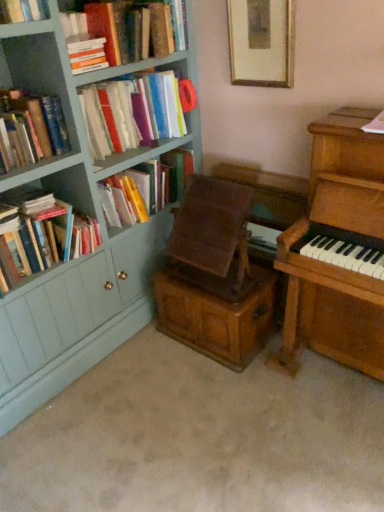
Looking at this image, what is the approximate height of hardcover books at upper left, the 6th book ordered from the bottom?

The height of hardcover books at upper left, the 6th book ordered from the bottom, is 10.44 inches.

At what (x,y) coordinates should I click in order to perform the action: click on wooden piano at right. Please return your answer as a coordinate pair (x, y). Looking at the image, I should click on (338, 250).

You are a GUI agent. You are given a task and a screenshot of the screen. Output one action in this format:
    pyautogui.click(x=<x>, y=<y>)
    Task: Click on the hardcover books at left, positioned as the fourth book in top-to-bottom order
    This screenshot has height=512, width=384.
    Given the screenshot: What is the action you would take?
    pyautogui.click(x=30, y=129)

Identify the location of hardcover books at upper left, the fourth book positioned from the bottom. (131, 113).

In order to click on hardcover books at left, which is counted as the first book, starting from the bottom in this screenshot , I will do `click(50, 228)`.

This screenshot has height=512, width=384. What do you see at coordinates (156, 181) in the screenshot? I see `hardcover book at left, the 5th book viewed from the top` at bounding box center [156, 181].

This screenshot has width=384, height=512. I want to click on hardcover books at upper left, which appears as the first book when viewed from the top, so click(x=126, y=27).

Does wooden chest at center turn towards wooden piano at right?

No, wooden chest at center is not oriented towards wooden piano at right.

Based on their positions, is wooden chest at center located to the left or right of wooden piano at right?

wooden chest at center is positioned on wooden piano at right's left side.

Considering the points (179, 305) and (349, 110), which point is behind, point (179, 305) or point (349, 110)?

The point (179, 305) is more distant.

Considering the positions of objects wooden chest at center and wooden piano at right in the image provided, who is in front, wooden chest at center or wooden piano at right?

wooden piano at right is closer to the camera.

Does hardcover books at upper left, the 6th book ordered from the bottom, have a greater height compared to hardcover book at left, the 2th book ordered from the bottom?

No, hardcover books at upper left, the 6th book ordered from the bottom, is not taller than hardcover book at left, the 2th book ordered from the bottom.

From a real-world perspective, is hardcover books at upper left, which appears as the first book when viewed from the top, over hardcover book at left, the 5th book viewed from the top?

Correct, in the physical world, hardcover books at upper left, which appears as the first book when viewed from the top, is higher than hardcover book at left, the 5th book viewed from the top.

How distant is hardcover books at upper left, the 6th book ordered from the bottom, from hardcover book at left, the 5th book viewed from the top?

The distance of hardcover books at upper left, the 6th book ordered from the bottom, from hardcover book at left, the 5th book viewed from the top, is 23.04 inches.

In the image, is hardcover books at upper left, the 6th book ordered from the bottom, positioned in front of or behind hardcover book at left, the 5th book viewed from the top?

hardcover books at upper left, the 6th book ordered from the bottom, is in front of hardcover book at left, the 5th book viewed from the top.

Do you think hardcover books at upper left, the fourth book positioned from the bottom, is within hardcover books at upper left, the 6th book ordered from the bottom, or outside of it?

hardcover books at upper left, the fourth book positioned from the bottom, is not enclosed by hardcover books at upper left, the 6th book ordered from the bottom.

From a real-world perspective, is hardcover books at upper left, the fourth book positioned from the bottom, located beneath hardcover books at upper left, the 6th book ordered from the bottom?

Yes, from a real-world perspective, hardcover books at upper left, the fourth book positioned from the bottom, is below hardcover books at upper left, the 6th book ordered from the bottom.

Is point (150, 181) positioned after point (262, 319)?

Yes, point (150, 181) is behind point (262, 319).

Is wooden chest at center inside hardcover book at left, the 5th book viewed from the top?

No, wooden chest at center is not inside hardcover book at left, the 5th book viewed from the top.

In terms of size, does hardcover book at left, the 5th book viewed from the top, appear bigger or smaller than wooden chest at center?

hardcover book at left, the 5th book viewed from the top, is smaller than wooden chest at center.

Is point (248, 16) closer to viewer compared to point (56, 210)?

No, it is not.

Is wooden picture frame at upper center at the right side of hardcover books at left, which is counted as the first book, starting from the bottom?

Correct, you'll find wooden picture frame at upper center to the right of hardcover books at left, which is counted as the first book, starting from the bottom.

Can you confirm if wooden picture frame at upper center is shorter than hardcover books at left, which is counted as the first book, starting from the bottom?

No.

Considering the relative sizes of wooden picture frame at upper center and hardcover books at left, which is counted as the first book, starting from the bottom, in the image provided, is wooden picture frame at upper center bigger than hardcover books at left, which is counted as the first book, starting from the bottom,?

No.

In the scene shown: Considering the relative positions of hardcover book at left, the 2th book ordered from the bottom, and wooden piano at right in the image provided, is hardcover book at left, the 2th book ordered from the bottom, to the right of wooden piano at right from the viewer's perspective?

Incorrect, hardcover book at left, the 2th book ordered from the bottom, is not on the right side of wooden piano at right.

Is hardcover book at left, the 5th book viewed from the top, next to wooden piano at right and touching it?

There is a gap between hardcover book at left, the 5th book viewed from the top, and wooden piano at right.

Identify the location of piano on the right of hardcover book at left, the 5th book viewed from the top. (338, 250).

From the image's perspective, which one is positioned lower, hardcover book at left, the 5th book viewed from the top, or wooden piano at right?

wooden piano at right appears lower in the image.

Does hardcover books at left, the 6th book in the top-to-bottom sequence, turn towards hardcover books at left, the 3th book in the bottom-to-top sequence?

No, hardcover books at left, the 6th book in the top-to-bottom sequence, is not facing towards hardcover books at left, the 3th book in the bottom-to-top sequence.

Is hardcover books at left, the 6th book in the top-to-bottom sequence, further to camera compared to hardcover books at left, positioned as the fourth book in top-to-bottom order?

Yes, hardcover books at left, the 6th book in the top-to-bottom sequence, is further from the camera.

Can you see hardcover books at left, the 6th book in the top-to-bottom sequence, touching hardcover books at left, positioned as the fourth book in top-to-bottom order?

No, hardcover books at left, the 6th book in the top-to-bottom sequence, is not next to hardcover books at left, positioned as the fourth book in top-to-bottom order.

Is hardcover books at left, which is counted as the first book, starting from the bottom, bigger or smaller than hardcover books at left, positioned as the fourth book in top-to-bottom order?

Clearly, hardcover books at left, which is counted as the first book, starting from the bottom, is larger in size than hardcover books at left, positioned as the fourth book in top-to-bottom order.

What are the coordinates of `piano above the wooden chest at center (from the image's perspective)` in the screenshot? It's located at [338, 250].

Which book is the 4th one when counting from the back of the hardcover books at upper left, the 6th book ordered from the bottom? Please provide its 2D coordinates.

[(156, 181)]

When comparing their distances from hardcover books at upper left, the 6th book ordered from the bottom, does hardcover books at left, the 3th book in the bottom-to-top sequence, or hardcover book at left, the 2th book ordered from the bottom, seem further?

hardcover book at left, the 2th book ordered from the bottom, lies further to hardcover books at upper left, the 6th book ordered from the bottom, than the other object.

Considering their positions, is hardcover books at left, which is counted as the first book, starting from the bottom, positioned further to hardcover book at upper left, which is the 5th book from bottom to top, than wooden piano at right?

wooden piano at right is positioned further to the anchor hardcover book at upper left, which is the 5th book from bottom to top.

Considering their positions, is hardcover books at left, positioned as the fourth book in top-to-bottom order, positioned further to hardcover book at upper left, which is the 5th book from bottom to top, than hardcover books at upper left, the third book from the top?

hardcover books at upper left, the third book from the top, lies further to hardcover book at upper left, which is the 5th book from bottom to top, than the other object.

Which object lies further to the anchor point hardcover book at left, the 2th book ordered from the bottom, hardcover book at upper left, arranged as the 2th book when viewed from the top, or hardcover books at upper left, the fourth book positioned from the bottom?

The object further to hardcover book at left, the 2th book ordered from the bottom, is hardcover book at upper left, arranged as the 2th book when viewed from the top.

Which object lies further to the anchor point hardcover books at left, the 6th book in the top-to-bottom sequence, hardcover books at upper left, the third book from the top, or wooden piano at right?

wooden piano at right.

Estimate the real-world distances between objects in this image. Which object is closer to hardcover books at left, the 3th book in the bottom-to-top sequence, hardcover books at upper left, the 6th book ordered from the bottom, or hardcover books at left, which is counted as the first book, starting from the bottom?

Based on the image, hardcover books at left, which is counted as the first book, starting from the bottom, appears to be nearer to hardcover books at left, the 3th book in the bottom-to-top sequence.

Which object lies nearer to the anchor point wooden piano at right, wooden chest at center or hardcover book at upper left, which is the 5th book from bottom to top?

Among the two, wooden chest at center is located nearer to wooden piano at right.

Based on their spatial positions, is hardcover books at upper left, the 6th book ordered from the bottom, or hardcover book at left, the 5th book viewed from the top, closer to wooden chest at center?

hardcover book at left, the 5th book viewed from the top, lies closer to wooden chest at center than the other object.

This screenshot has height=512, width=384. In order to click on book situated between hardcover books at left, the 3th book in the bottom-to-top sequence, and hardcover books at upper left, the third book from the top, from left to right in this screenshot , I will do `click(86, 53)`.

The width and height of the screenshot is (384, 512). Identify the location of book between hardcover books at upper left, which appears as the first book when viewed from the top, and hardcover books at upper left, the fourth book positioned from the bottom, in the up-down direction. (86, 53).

Locate an element on the screen. book located between hardcover books at upper left, which appears as the first book when viewed from the top, and wooden picture frame at upper center in the left-right direction is located at coordinates (156, 181).

The image size is (384, 512). Find the location of `picture frame between hardcover books at left, the 6th book in the top-to-bottom sequence, and wooden piano at right from left to right`. picture frame between hardcover books at left, the 6th book in the top-to-bottom sequence, and wooden piano at right from left to right is located at coordinates (261, 42).